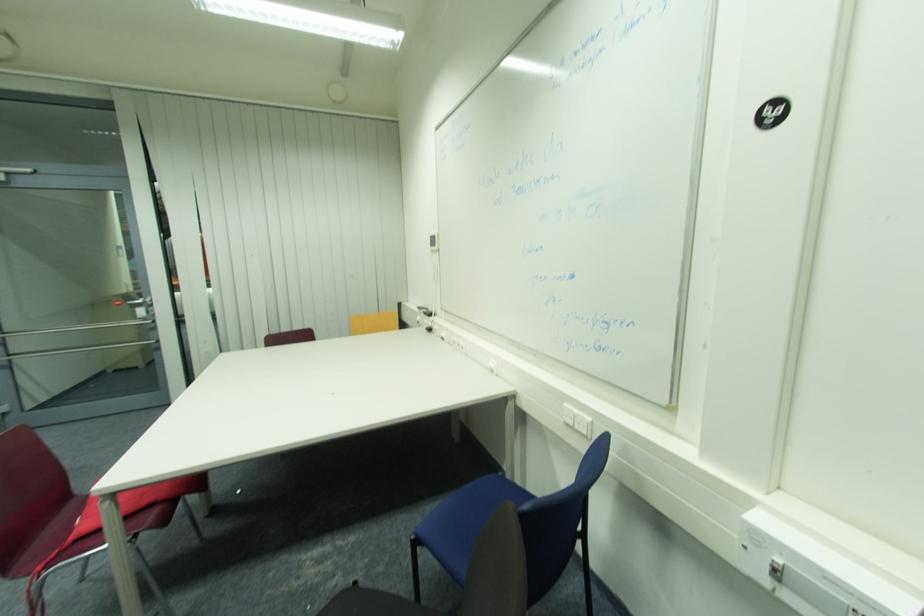
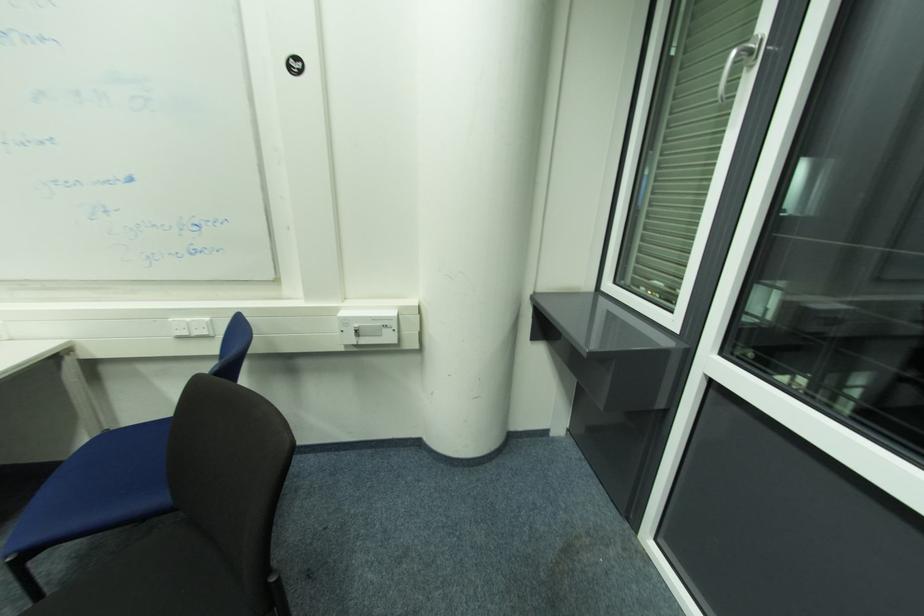
First-person continuous shooting, in which direction is the camera rotating?

The rotation direction of the camera is right-down.